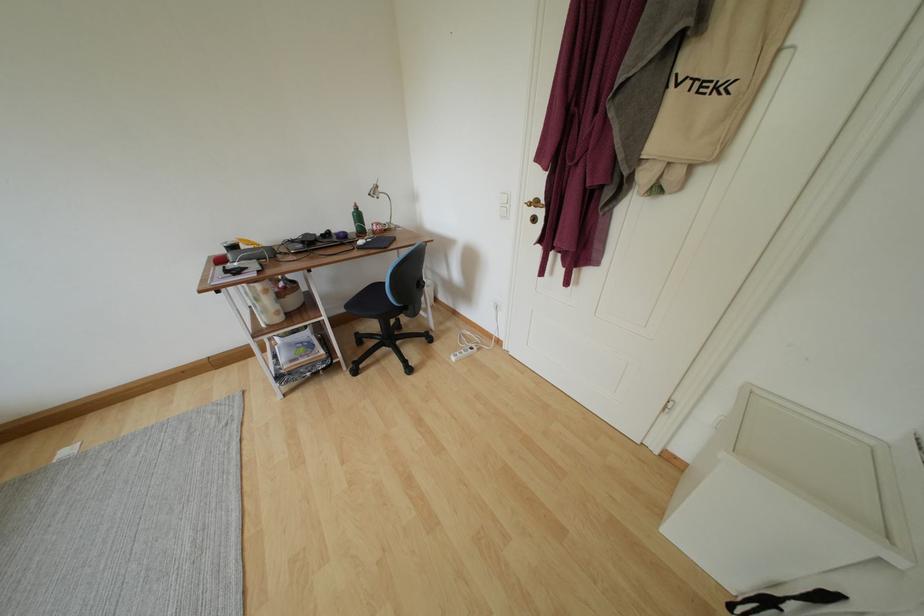
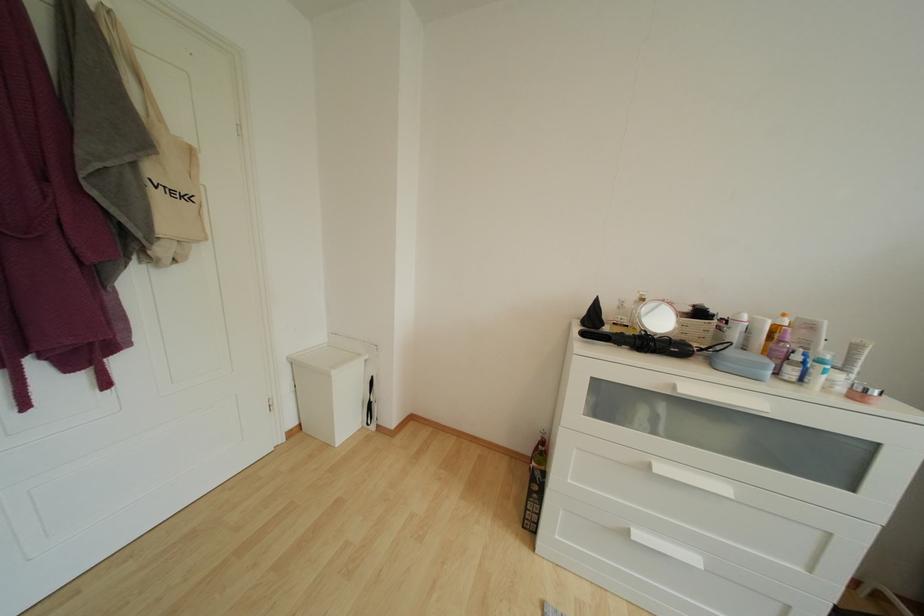
How did the camera likely rotate?

The camera's rotation is toward right-down.